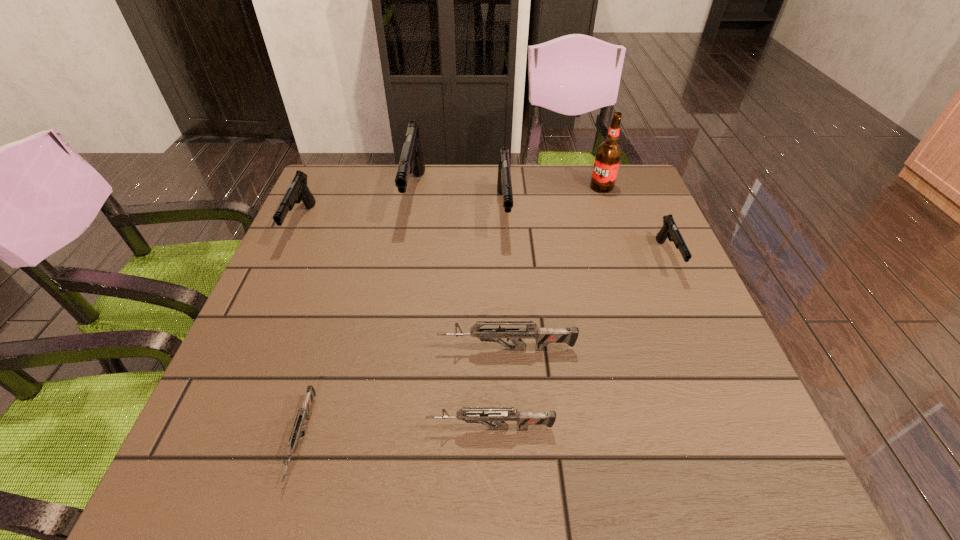
Identify the location of free location located 0.100m at the aiming end of the rightmost gun. The width and height of the screenshot is (960, 540). (693, 315).

Where is `vacant space located 0.320m aimed along the barrel of the fifth farthest gun`? The image size is (960, 540). vacant space located 0.320m aimed along the barrel of the fifth farthest gun is located at coordinates (277, 349).

Where is `free location located 0.290m aimed along the barrel of the fifth farthest gun`? The width and height of the screenshot is (960, 540). free location located 0.290m aimed along the barrel of the fifth farthest gun is located at coordinates (293, 349).

You are a GUI agent. You are given a task and a screenshot of the screen. Output one action in this format:
    pyautogui.click(x=<x>, y=<y>)
    Task: Click on the vacant region located 0.130m aimed along the barrel of the fifth farthest gun
    
    Given the screenshot: What is the action you would take?
    pyautogui.click(x=373, y=349)

Find the location of a particular element. The height and width of the screenshot is (540, 960). free space located 0.170m aimed along the barrel of the seventh tallest object is located at coordinates (329, 428).

Image resolution: width=960 pixels, height=540 pixels. In order to click on vacant region located 0.270m aimed along the barrel of the seventh tallest object in this screenshot , I will do `click(271, 428)`.

You are a GUI agent. You are given a task and a screenshot of the screen. Output one action in this format:
    pyautogui.click(x=<x>, y=<y>)
    Task: Click on the free space located aimed along the barrel of the seventh tallest object
    The height and width of the screenshot is (540, 960).
    Given the screenshot: What is the action you would take?
    pyautogui.click(x=370, y=428)

Find the location of a particular element. Image resolution: width=960 pixels, height=540 pixels. root beer situated at the far edge is located at coordinates (608, 155).

This screenshot has width=960, height=540. I want to click on object that is at the near edge, so click(x=298, y=426).

Identify the location of object situated at the left edge. The width and height of the screenshot is (960, 540). (298, 189).